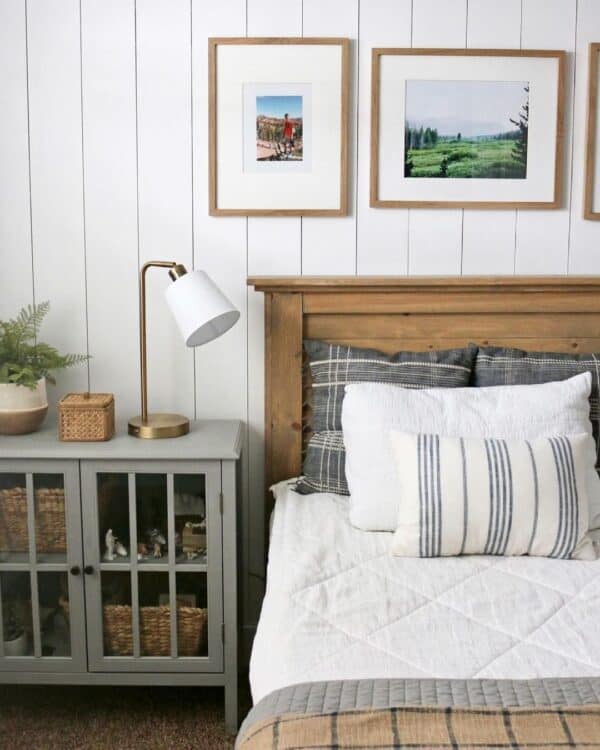
Find the location of a particular element. This screenshot has height=750, width=600. wicker basket is located at coordinates (87, 417), (45, 512), (156, 632).